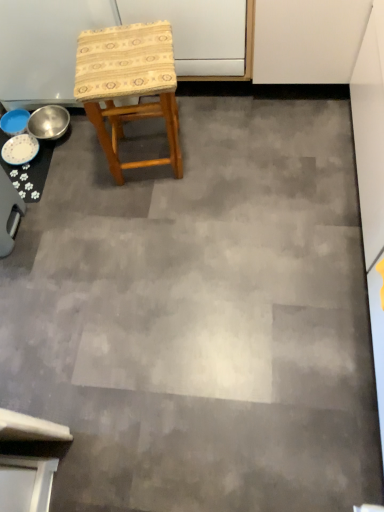
Question: Can you confirm if woven fabric stool at center is wider than metallic silver bowl at left?

Choices:
 (A) no
 (B) yes

Answer: (B)

Question: Is woven fabric stool at center further to camera compared to metallic silver bowl at left?

Choices:
 (A) yes
 (B) no

Answer: (B)

Question: Is woven fabric stool at center bigger than metallic silver bowl at left?

Choices:
 (A) yes
 (B) no

Answer: (A)

Question: Is woven fabric stool at center oriented towards metallic silver bowl at left?

Choices:
 (A) yes
 (B) no

Answer: (B)

Question: Is woven fabric stool at center positioned before metallic silver bowl at left?

Choices:
 (A) yes
 (B) no

Answer: (A)

Question: From a real-world perspective, is woven fabric stool at center beneath metallic silver bowl at left?

Choices:
 (A) yes
 (B) no

Answer: (B)

Question: Is the depth of white glossy plate at lower left greater than that of metallic silver bowl at left?

Choices:
 (A) yes
 (B) no

Answer: (B)

Question: Is white glossy plate at lower left positioned before metallic silver bowl at left?

Choices:
 (A) no
 (B) yes

Answer: (B)

Question: Is white glossy plate at lower left wider than metallic silver bowl at left?

Choices:
 (A) no
 (B) yes

Answer: (A)

Question: Is white glossy plate at lower left outside metallic silver bowl at left?

Choices:
 (A) no
 (B) yes

Answer: (B)

Question: Considering the relative positions of white glossy plate at lower left and metallic silver bowl at left in the image provided, is white glossy plate at lower left to the right of metallic silver bowl at left from the viewer's perspective?

Choices:
 (A) yes
 (B) no

Answer: (B)

Question: From a real-world perspective, does white glossy plate at lower left stand above metallic silver bowl at left?

Choices:
 (A) yes
 (B) no

Answer: (B)

Question: Are metallic silver bowl at left and white glossy plate at lower left beside each other?

Choices:
 (A) yes
 (B) no

Answer: (B)